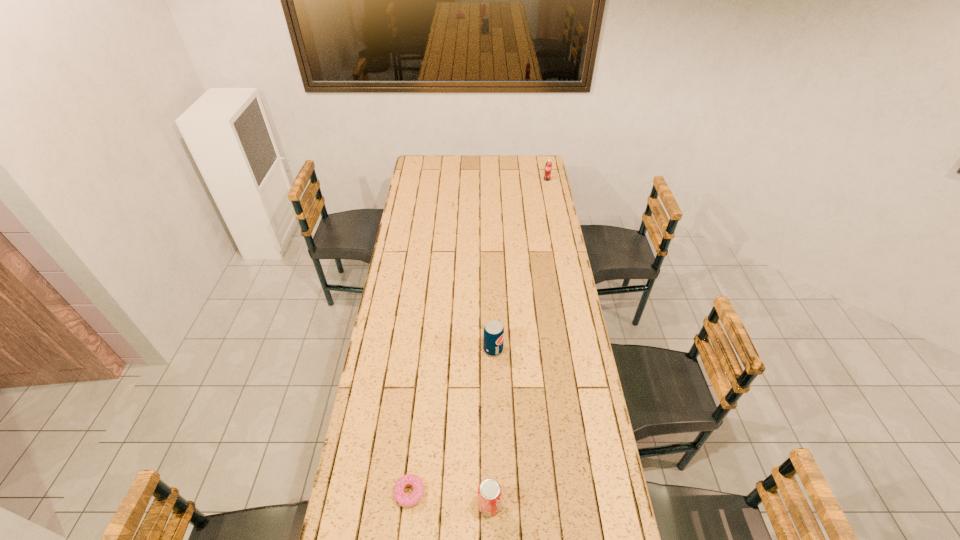
This screenshot has width=960, height=540. Identify the location of the rightmost soda can. [548, 167].

The height and width of the screenshot is (540, 960). I want to click on the farthest soda can, so click(x=548, y=167).

Where is `the second farthest object`? This screenshot has width=960, height=540. the second farthest object is located at coordinates (493, 335).

The width and height of the screenshot is (960, 540). I want to click on the nearest soda can, so click(489, 491).

At what (x,y) coordinates should I click in order to perform the action: click on the shortest object. Please return your answer as a coordinate pair (x, y). This screenshot has height=540, width=960. Looking at the image, I should click on (404, 500).

Locate an element on the screen. doughnut is located at coordinates (404, 500).

Where is `free space located on the label of the rightmost soda can`? Image resolution: width=960 pixels, height=540 pixels. free space located on the label of the rightmost soda can is located at coordinates (554, 213).

The image size is (960, 540). I want to click on free space located on the left of the second farthest soda can, so click(x=437, y=349).

Where is `free spot located 0.380m on the back of the nearest soda can`? This screenshot has height=540, width=960. free spot located 0.380m on the back of the nearest soda can is located at coordinates (488, 383).

The height and width of the screenshot is (540, 960). What are the coordinates of `free space located on the right of the doughnut` in the screenshot? It's located at point(488,493).